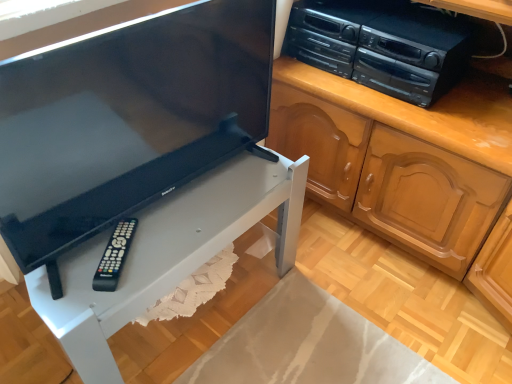
Question: Which is correct: black plastic stereo at upper right is inside matte black television at center, or outside of it?

Choices:
 (A) outside
 (B) inside

Answer: (A)

Question: Would you say black plastic stereo at upper right is to the left or to the right of matte black television at center in the picture?

Choices:
 (A) left
 (B) right

Answer: (B)

Question: Estimate the real-world distances between objects in this image. Which object is closer to the black plastic stereo at upper right?

Choices:
 (A) matte black television at center
 (B) black plastic remote at lower left
 (C) white matte table at lower left

Answer: (C)

Question: Estimate the real-world distances between objects in this image. Which object is farther from the black plastic stereo at upper right?

Choices:
 (A) matte black television at center
 (B) white matte table at lower left
 (C) black plastic remote at lower left

Answer: (C)